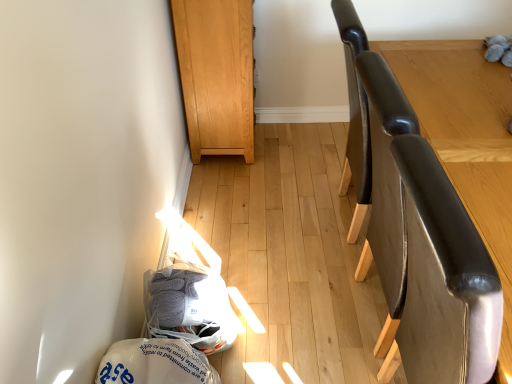
This screenshot has width=512, height=384. I want to click on empty space that is in between light brown wood cabinet at upper center and gray yarn at lower left, which is the 1th material from top to bottom, so click(x=227, y=219).